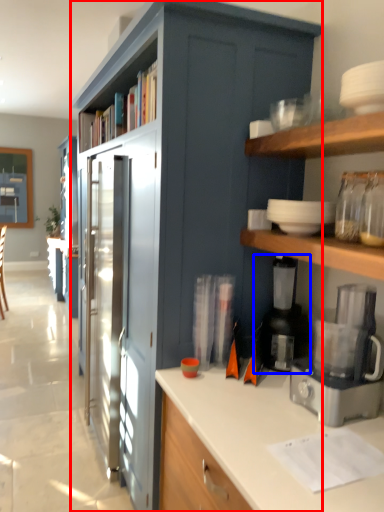
Question: Which object is further to the camera taking this photo, cabinetry (highlighted by a red box) or appliance (highlighted by a blue box)?

Choices:
 (A) cabinetry
 (B) appliance

Answer: (B)